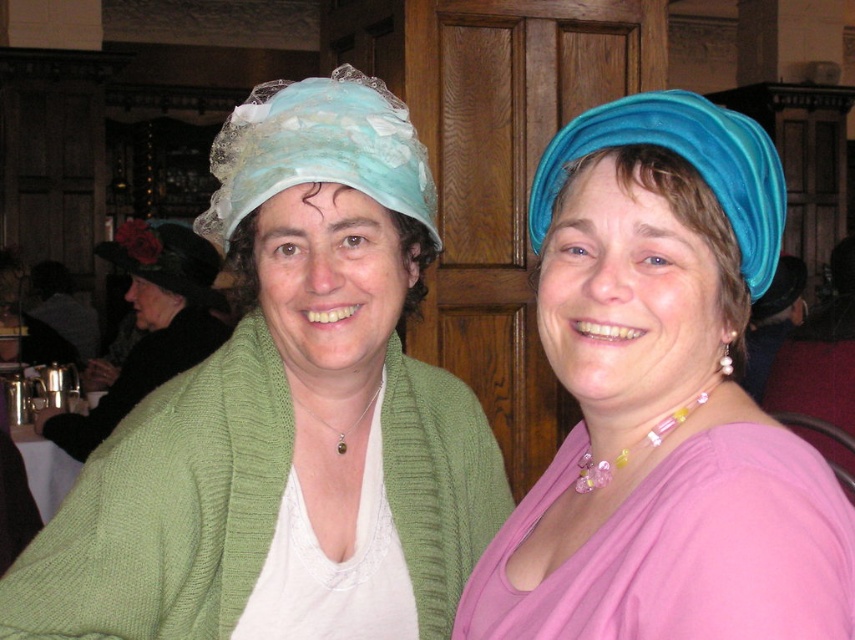
Question: Which point appears farthest from the camera in this image?

Choices:
 (A) (741, 458)
 (B) (72, 493)
 (C) (144, 284)
 (D) (528, 216)

Answer: (C)

Question: Which object is closer to the camera taking this photo?

Choices:
 (A) pink satin robe at center
 (B) green knitted robe at center
 (C) blue velvet headscarf at upper right
 (D) black felt hat at left

Answer: (A)

Question: Is pink satin robe at center to the right of blue velvet headscarf at upper right from the viewer's perspective?

Choices:
 (A) yes
 (B) no

Answer: (B)

Question: Does blue velvet hat at upper right have a larger size compared to black felt hat at left?

Choices:
 (A) no
 (B) yes

Answer: (A)

Question: Which object appears farthest from the camera in this image?

Choices:
 (A) blue velvet hat at upper right
 (B) blue velvet headscarf at upper right
 (C) green knitted robe at center

Answer: (C)

Question: Can you confirm if green knitted robe at center is positioned below black felt hat at left?

Choices:
 (A) yes
 (B) no

Answer: (A)